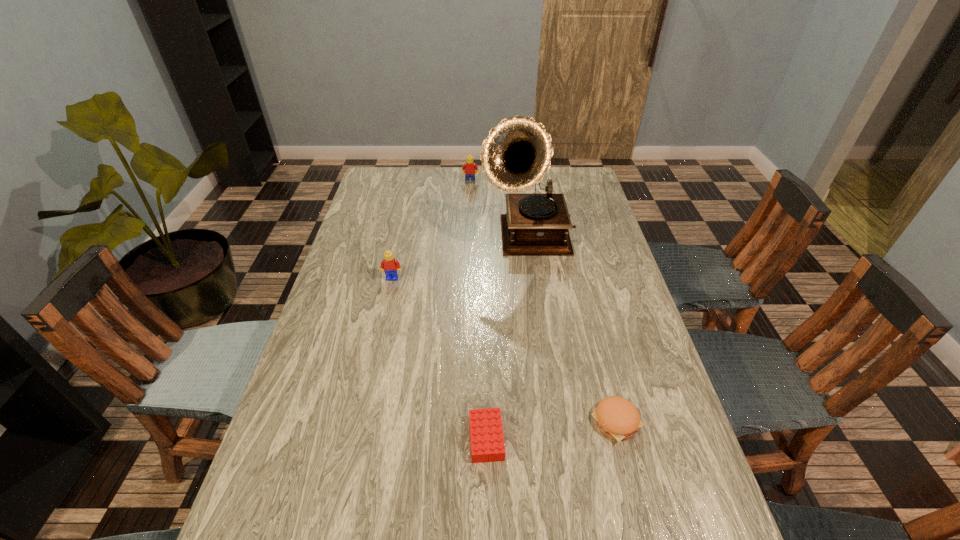
This screenshot has height=540, width=960. I want to click on empty location between the farthest object and the patty, so (x=543, y=302).

Choose which object is the nearest neighbor to the nearest Lego. Please provide its 2D coordinates. Your answer should be formatted as a tuple, i.e. [(x, y)], where the tuple contains the x and y coordinates of a point satisfying the conditions above.

[(616, 417)]

Select which object is the third closest to the nearest Lego. Please provide its 2D coordinates. Your answer should be formatted as a tuple, i.e. [(x, y)], where the tuple contains the x and y coordinates of a point satisfying the conditions above.

[(516, 154)]

This screenshot has width=960, height=540. Identify the location of Lego that stands as the second closest to the fourth nearest object. (389, 265).

Identify the location of the second closest Lego to the farthest Lego. The height and width of the screenshot is (540, 960). (487, 442).

You are a GUI agent. You are given a task and a screenshot of the screen. Output one action in this format:
    pyautogui.click(x=<x>, y=<y>)
    Task: Click on the free spot that satisfies the following two spatial constraints: 1. on the front-facing side of the farthest object; 2. on the left side of the patty
    The width and height of the screenshot is (960, 540).
    Given the screenshot: What is the action you would take?
    pyautogui.click(x=463, y=422)